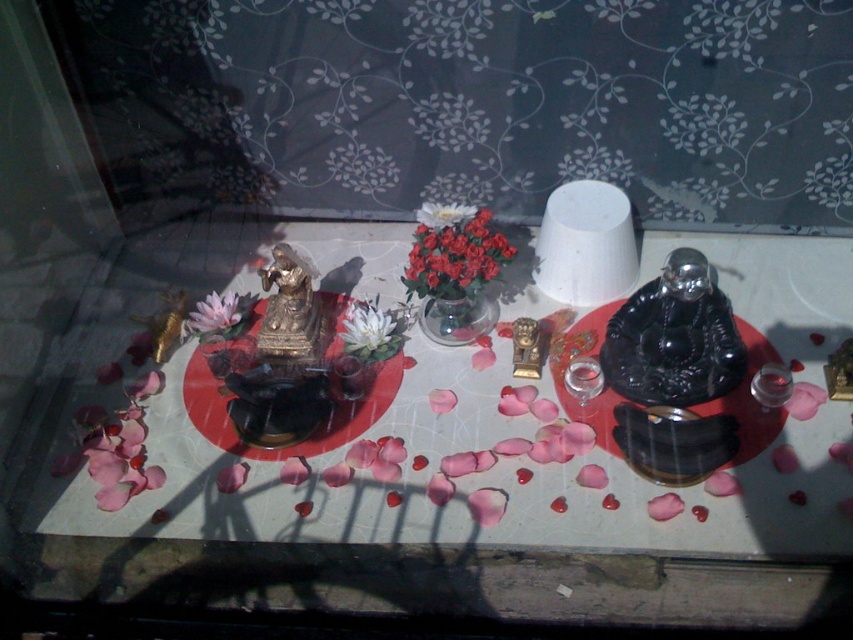
Question: Observing the image, what is the correct spatial positioning of gold metallic statue at center in reference to pink matte flower at center?

Choices:
 (A) right
 (B) left

Answer: (A)

Question: Which of the following is the closest to the observer?

Choices:
 (A) (502, 237)
 (B) (264, 314)
 (C) (229, 291)

Answer: (A)

Question: Does red matte flowers at center have a greater width compared to gold metallic statue at center?

Choices:
 (A) yes
 (B) no

Answer: (A)

Question: Among these objects, which one is nearest to the camera?

Choices:
 (A) pink matte flower at center
 (B) gold metallic statue at center
 (C) white matte flower at center

Answer: (B)

Question: Is gold metallic statue at center further to camera compared to white matte flower at center?

Choices:
 (A) yes
 (B) no

Answer: (B)

Question: Based on their relative distances, which object is farther from the red matte flowers at center?

Choices:
 (A) gold metallic statue at center
 (B) pink matte flower at center

Answer: (B)